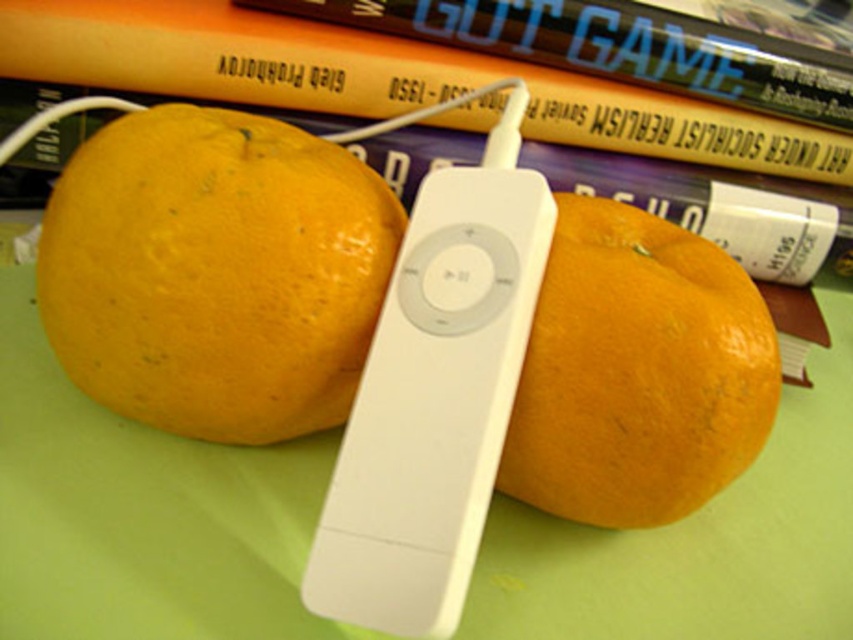
Can you confirm if white plastic remote at center is bigger than hardcover book at upper center?

No, white plastic remote at center is not bigger than hardcover book at upper center.

Between white plastic remote at center and hardcover book at upper center, which one appears on the right side from the viewer's perspective?

hardcover book at upper center is more to the right.

Is point (440, 320) positioned after point (730, 134)?

No.

Image resolution: width=853 pixels, height=640 pixels. I want to click on white plastic remote at center, so click(x=432, y=404).

The width and height of the screenshot is (853, 640). Describe the element at coordinates (215, 273) in the screenshot. I see `yellow matte/orange at center` at that location.

Who is more distant from viewer, (321, 284) or (648, 220)?

Point (648, 220)

Locate an element on the screen. yellow matte/orange at center is located at coordinates (215, 273).

Is green matte table at center shorter than white plastic remote at center?

Indeed, green matte table at center has a lesser height compared to white plastic remote at center.

Is green matte table at center in front of white plastic remote at center?

No, green matte table at center is behind white plastic remote at center.

Measure the distance between point (128, 586) and camera.

Point (128, 586) is 20.33 inches from camera.

Locate an element on the screen. The height and width of the screenshot is (640, 853). green matte table at center is located at coordinates pyautogui.click(x=141, y=515).